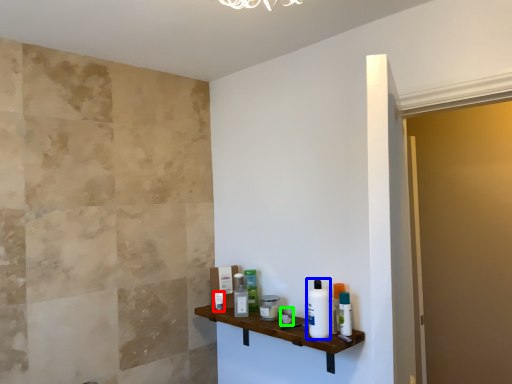
Question: Considering the real-world distances, which object is closest to toiletry (highlighted by a red box)? toiletry (highlighted by a blue box) or toiletry (highlighted by a green box).

Choices:
 (A) toiletry
 (B) toiletry

Answer: (B)